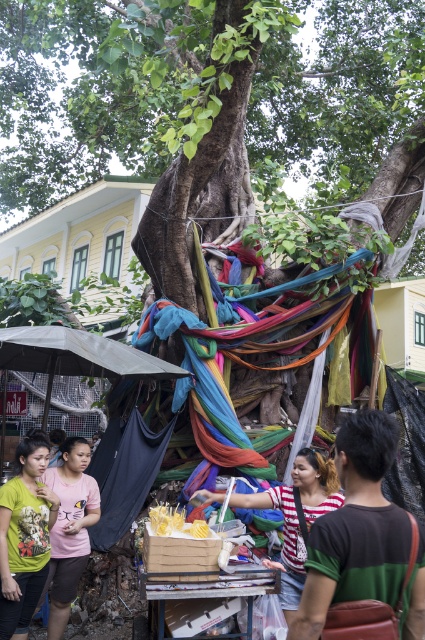
Question: In this image, where is green printed t-shirt at lower left located relative to pink matte t-shirt at center?

Choices:
 (A) above
 (B) below

Answer: (A)

Question: From the image, what is the correct spatial relationship of green printed t-shirt at lower left in relation to pink matte t-shirt at center?

Choices:
 (A) above
 (B) below

Answer: (A)

Question: In this image, where is gray fabric canopy at lower left located relative to striped fabric at center?

Choices:
 (A) above
 (B) below

Answer: (A)

Question: Which object is the farthest from the gray fabric canopy at lower left?

Choices:
 (A) pink matte t-shirt at center
 (B) green printed t-shirt at lower left
 (C) striped fabric stall at lower right
 (D) striped fabric at center

Answer: (C)

Question: Which of the following is the closest to the observer?

Choices:
 (A) striped fabric at center
 (B) pink matte t-shirt at center
 (C) gray fabric canopy at lower left
 (D) striped fabric stall at lower right

Answer: (D)

Question: Which object is positioned farthest from the green printed t-shirt at lower left?

Choices:
 (A) pink matte t-shirt at center
 (B) striped fabric at center

Answer: (B)